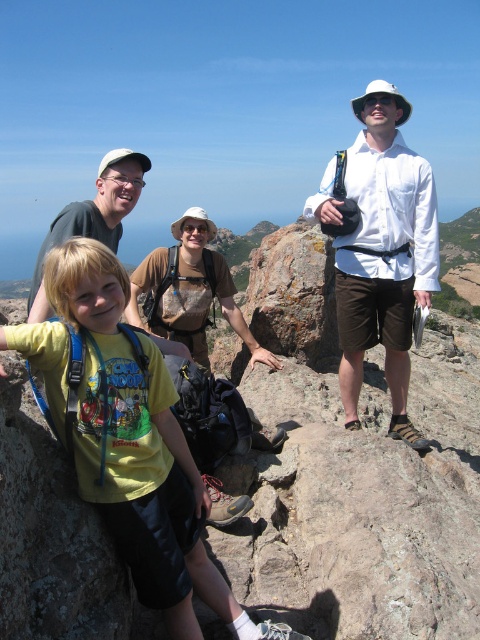
Question: Is yellow cotton shirt at center further to the viewer compared to white cotton shirt at center?

Choices:
 (A) yes
 (B) no

Answer: (B)

Question: Which of the following is the closest to the observer?

Choices:
 (A) matte green shirt at center
 (B) brown canvas backpack at center

Answer: (B)

Question: Does yellow cotton shirt at center appear on the right side of white cotton shirt at center?

Choices:
 (A) yes
 (B) no

Answer: (B)

Question: Among these points, which one is farthest from the camera?

Choices:
 (A) (399, 340)
 (B) (132, 188)
 (C) (97, 340)
 (D) (162, 332)

Answer: (D)

Question: Which is farther from the matte green shirt at center?

Choices:
 (A) brown canvas backpack at center
 (B) yellow cotton shirt at center
 (C) white cotton shirt at center

Answer: (C)

Question: From the image, what is the correct spatial relationship of white cotton shirt at center in relation to brown canvas backpack at center?

Choices:
 (A) below
 (B) above

Answer: (B)